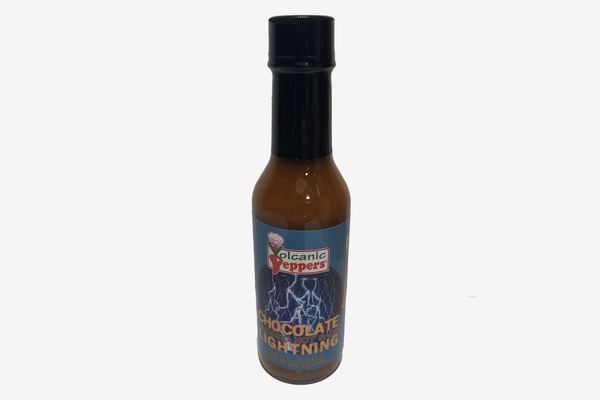
Identify the location of bottle. The width and height of the screenshot is (600, 400). (308, 200).